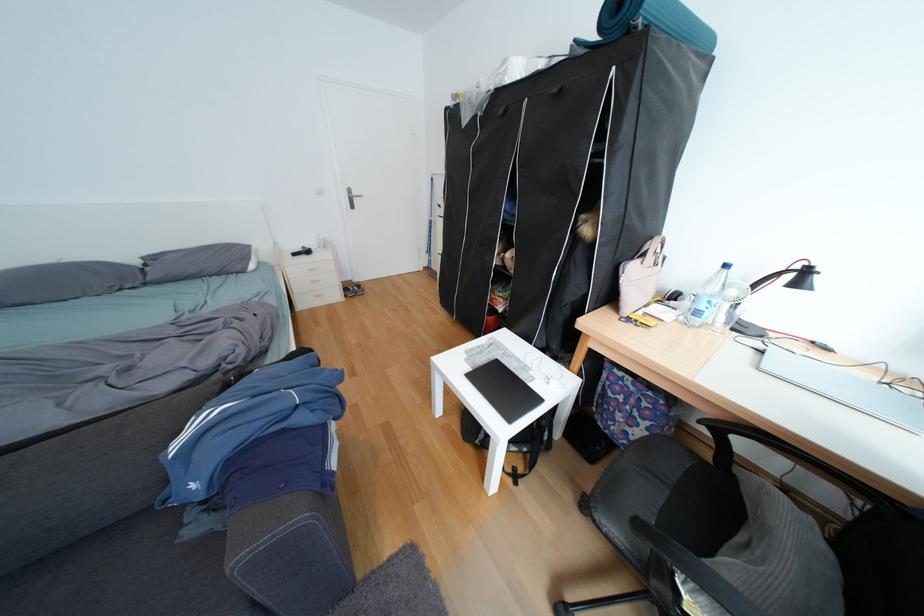
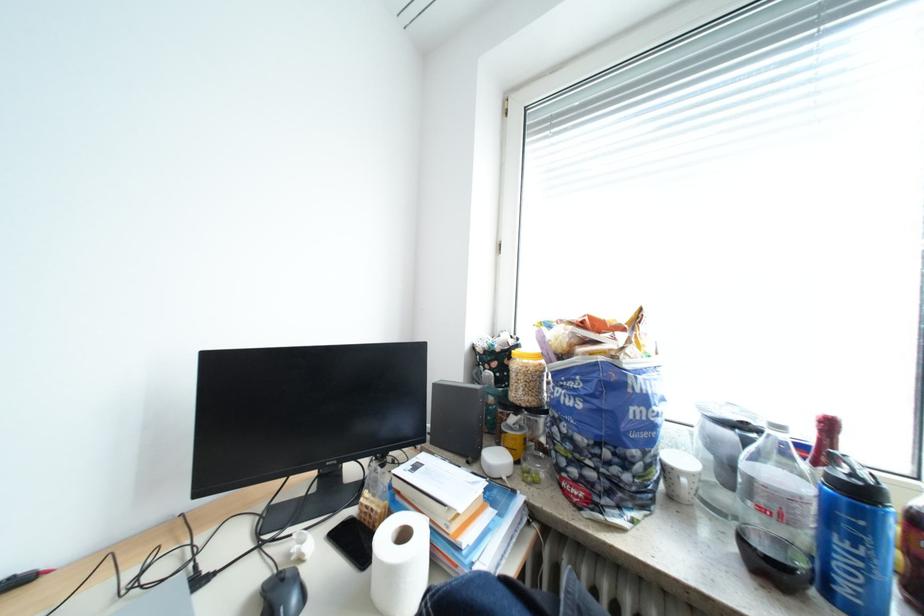
Question: The camera is either moving clockwise (left) or counter-clockwise (right) around the object. The first image is from the beginning of the video and the second image is from the end. Is the camera moving left or right when shooting the video?

Choices:
 (A) Left
 (B) Right

Answer: (A)